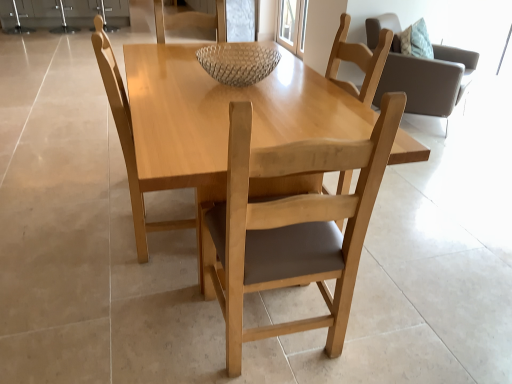
Question: Is transparent glass door at upper center looking in the opposite direction of light wood chair at center, which is the second chair in right-to-left order?

Choices:
 (A) yes
 (B) no

Answer: (B)

Question: From the image's perspective, would you say transparent glass door at upper center is positioned over light wood chair at center, the second chair viewed from the left?

Choices:
 (A) no
 (B) yes

Answer: (B)

Question: Is transparent glass door at upper center bigger than light wood chair at center, which is the second chair in right-to-left order?

Choices:
 (A) yes
 (B) no

Answer: (B)

Question: Can you confirm if transparent glass door at upper center is positioned to the right of light wood chair at center, which is the second chair in right-to-left order?

Choices:
 (A) no
 (B) yes

Answer: (B)

Question: Can you confirm if transparent glass door at upper center is smaller than light wood chair at center, which is the third chair in back-to-front order?

Choices:
 (A) yes
 (B) no

Answer: (A)

Question: Considering the positions of point (280, 23) and point (247, 44), is point (280, 23) closer or farther from the camera than point (247, 44)?

Choices:
 (A) closer
 (B) farther

Answer: (B)

Question: Considering the positions of transparent glass door at upper center and clear glass bowl at center in the image, is transparent glass door at upper center bigger or smaller than clear glass bowl at center?

Choices:
 (A) big
 (B) small

Answer: (A)

Question: In terms of height, does transparent glass door at upper center look taller or shorter compared to clear glass bowl at center?

Choices:
 (A) short
 (B) tall

Answer: (B)

Question: Is transparent glass door at upper center in front of or behind clear glass bowl at center in the image?

Choices:
 (A) front
 (B) behind

Answer: (B)

Question: Is light wood chair at center, marked as the 1th chair in a left-to-right arrangement, bigger or smaller than light wood chair at center, which is the second chair in right-to-left order?

Choices:
 (A) small
 (B) big

Answer: (A)

Question: In the image, is light wood chair at center, which is the 2th chair in back-to-front order, on the left side or the right side of light wood chair at center, the second chair viewed from the left?

Choices:
 (A) left
 (B) right

Answer: (A)

Question: Considering the positions of light wood chair at center, marked as the 1th chair in a left-to-right arrangement, and light wood chair at center, the second chair viewed from the left, in the image, is light wood chair at center, marked as the 1th chair in a left-to-right arrangement, wider or thinner than light wood chair at center, the second chair viewed from the left,?

Choices:
 (A) thin
 (B) wide

Answer: (B)

Question: From the image's perspective, is light wood chair at center, which appears as the third chair when viewed from the right, above or below light wood chair at center, which is the second chair in right-to-left order?

Choices:
 (A) above
 (B) below

Answer: (A)

Question: From the image's perspective, is light wood chair at center, marked as the 1th chair in a left-to-right arrangement, above or below light brown wood chair at upper right, the third chair viewed from the left?

Choices:
 (A) below
 (B) above

Answer: (A)

Question: From a real-world perspective, relative to light brown wood chair at upper right, which ranks as the first chair in back-to-front order, is light wood chair at center, the second chair from the front, vertically above or below?

Choices:
 (A) below
 (B) above

Answer: (B)